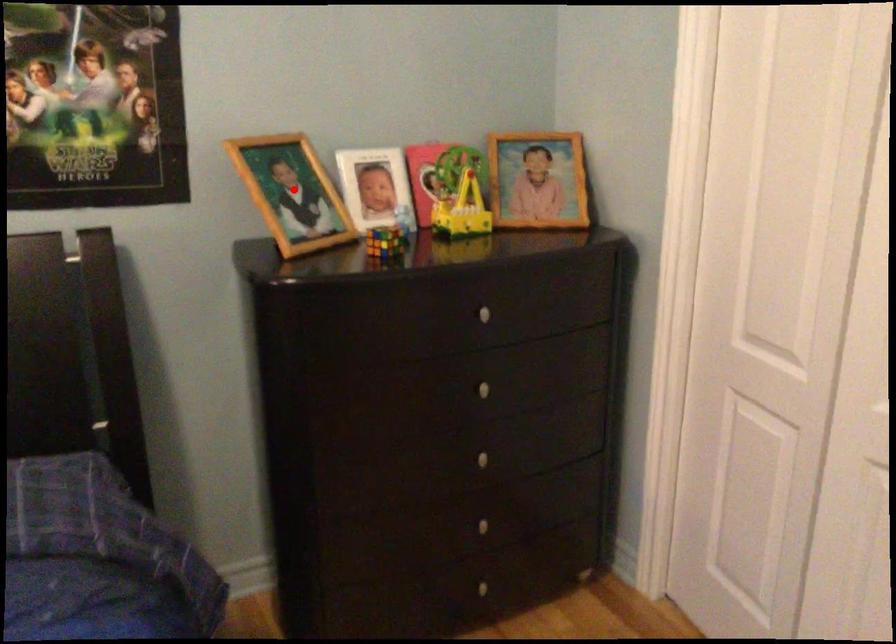
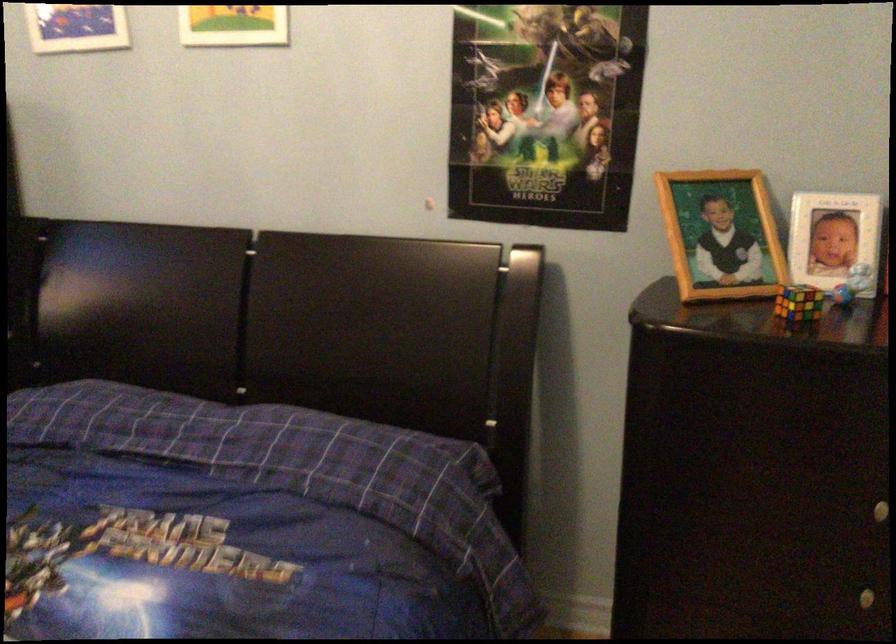
The point at the highlighted location is marked in the first image. Where is the corresponding point in the second image?

(720, 234)